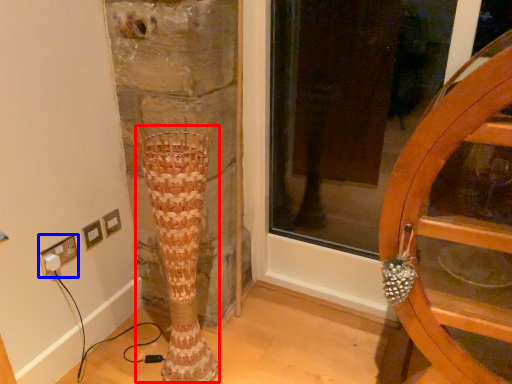
Question: Which of the following is the closest to the observer, tree trunk (highlighted by a red box) or electric outlet (highlighted by a blue box)?

Choices:
 (A) tree trunk
 (B) electric outlet

Answer: (A)